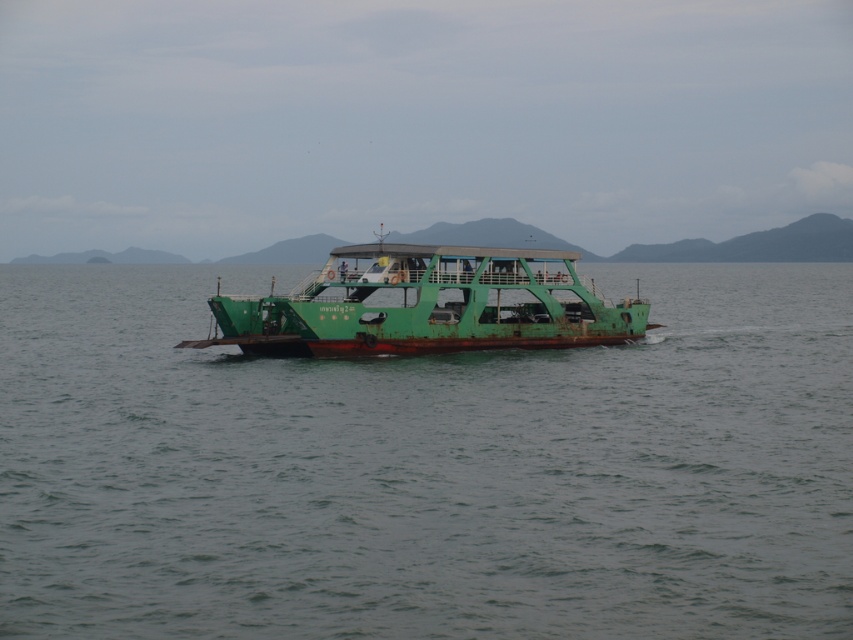
Question: Can you confirm if green matte water at center is positioned above green matte boat at center?

Choices:
 (A) no
 (B) yes

Answer: (B)

Question: Which object is farther from the camera taking this photo?

Choices:
 (A) green matte water at center
 (B) green matte boat at center

Answer: (B)

Question: In this image, where is green matte water at center located relative to green matte boat at center?

Choices:
 (A) right
 (B) left

Answer: (B)

Question: Is green matte water at center above green matte boat at center?

Choices:
 (A) no
 (B) yes

Answer: (B)